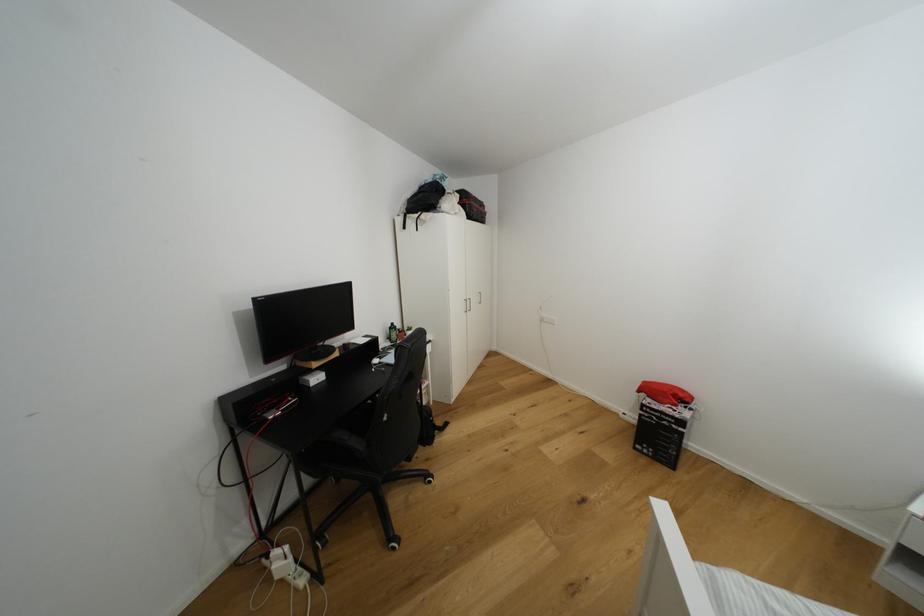
The image size is (924, 616). What are the coordinates of `small white box` in the screenshot? It's located at (311, 378).